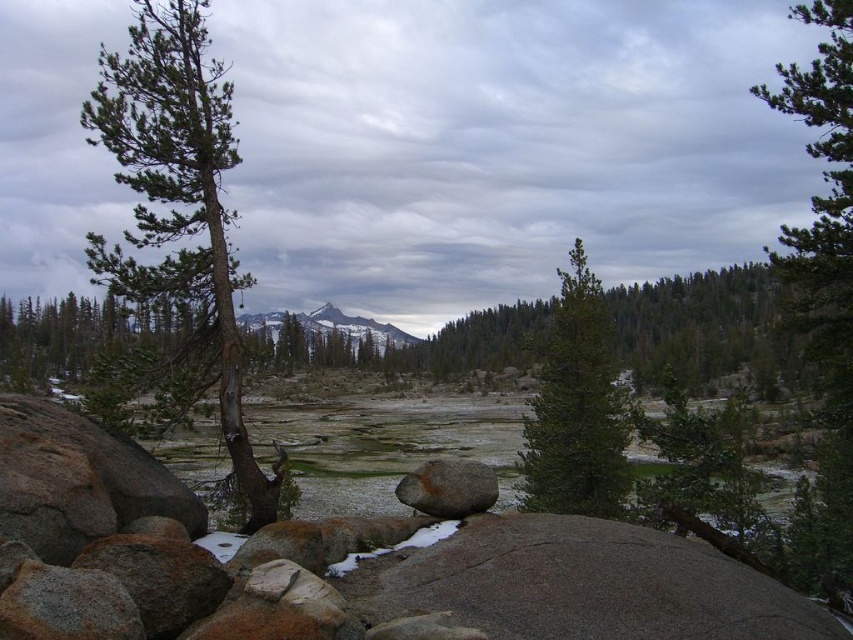
Based on the photo, does green textured pine tree at left lie behind rusty metallic boulder at center?

Yes, green textured pine tree at left is behind rusty metallic boulder at center.

Does point (230, 435) come closer to viewer compared to point (442, 468)?

That is False.

The width and height of the screenshot is (853, 640). Find the location of `green textured pine tree at left`. green textured pine tree at left is located at coordinates (178, 198).

Does green textured pine tree at left have a smaller size compared to green matte tree at center?

Actually, green textured pine tree at left might be larger than green matte tree at center.

The height and width of the screenshot is (640, 853). I want to click on green textured pine tree at left, so click(x=178, y=198).

Which is in front, point (227, 436) or point (578, 314)?

Point (227, 436) is in front.

Locate an element on the screen. The height and width of the screenshot is (640, 853). green textured pine tree at left is located at coordinates (178, 198).

Where is `green matte tree at center`? green matte tree at center is located at coordinates (576, 408).

The width and height of the screenshot is (853, 640). Describe the element at coordinates (576, 408) in the screenshot. I see `green matte tree at center` at that location.

Locate an element on the screen. The width and height of the screenshot is (853, 640). green matte tree at center is located at coordinates (576, 408).